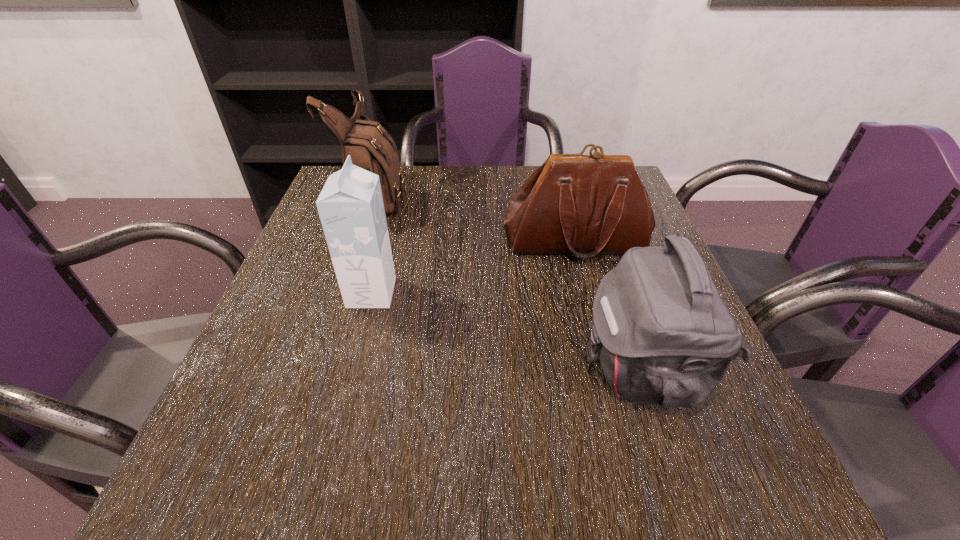
This screenshot has height=540, width=960. I want to click on the leftmost shoulder bag, so click(370, 146).

This screenshot has width=960, height=540. What are the coordinates of `the third farthest object` in the screenshot? It's located at (350, 206).

Locate an element on the screen. The image size is (960, 540). the nearest shoulder bag is located at coordinates (662, 334).

Locate an element on the screen. vacant space located 0.060m on the front-facing side of the leftmost shoulder bag is located at coordinates (429, 197).

Where is `vacant space situated 0.130m on the front label of the carton`? vacant space situated 0.130m on the front label of the carton is located at coordinates (456, 293).

Where is `free space located 0.350m on the open flap of the nearest object`? free space located 0.350m on the open flap of the nearest object is located at coordinates (383, 367).

Locate an element on the screen. The height and width of the screenshot is (540, 960). free space located 0.130m on the open flap of the nearest object is located at coordinates (509, 367).

I want to click on vacant region located 0.250m on the open flap of the nearest object, so click(440, 367).

This screenshot has width=960, height=540. I want to click on object positioned at the far edge, so pos(370,146).

Identify the location of shoulder bag present at the left edge. (370, 146).